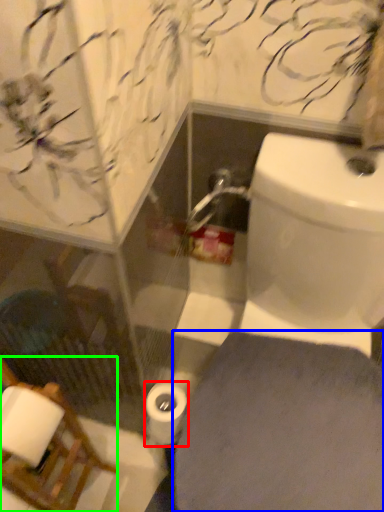
Question: Which is nearer to the toilet paper (highlighted by a red box)? porcelain (highlighted by a blue box) or chair (highlighted by a green box).

Choices:
 (A) porcelain
 (B) chair

Answer: (A)